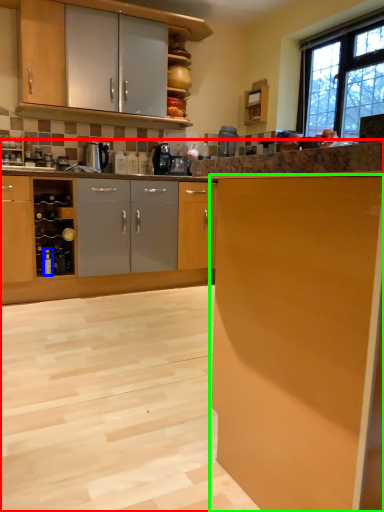
Question: Which object is positioned farthest from cabinetry (highlighted by a red box)? Select from bottle (highlighted by a blue box) and cabinetry (highlighted by a green box).

Choices:
 (A) bottle
 (B) cabinetry

Answer: (A)